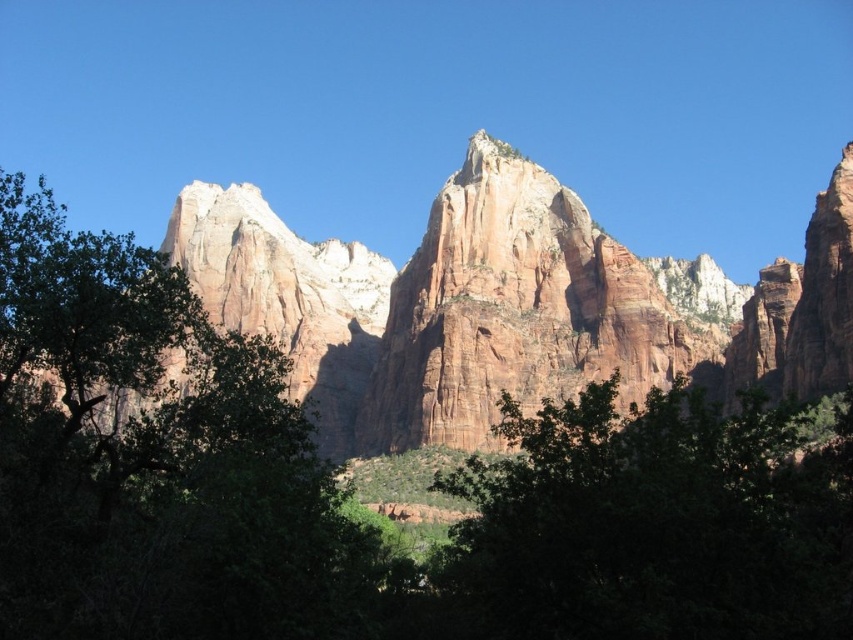
Question: Which object is the closest to the green leafy tree at center?

Choices:
 (A) green leafy tree at left
 (B) rustic sandstone cliff at center

Answer: (A)

Question: Is green leafy tree at center positioned at the back of rustic sandstone cliff at center?

Choices:
 (A) no
 (B) yes

Answer: (A)

Question: In this image, where is green leafy tree at center located relative to rustic sandstone cliff at center?

Choices:
 (A) left
 (B) right

Answer: (A)

Question: Which of the following is the closest to the observer?

Choices:
 (A) green leafy tree at left
 (B) rustic sandstone cliff at center
 (C) green leafy tree at center

Answer: (A)

Question: Does green leafy tree at left appear over green leafy tree at center?

Choices:
 (A) yes
 (B) no

Answer: (A)

Question: Among these objects, which one is nearest to the camera?

Choices:
 (A) green leafy tree at center
 (B) rustic sandstone cliff at center

Answer: (A)